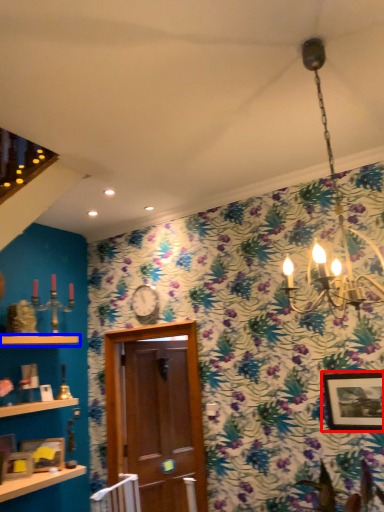
Question: Which object is further to the camera taking this photo, picture frame (highlighted by a red box) or shelf (highlighted by a blue box)?

Choices:
 (A) picture frame
 (B) shelf

Answer: (B)